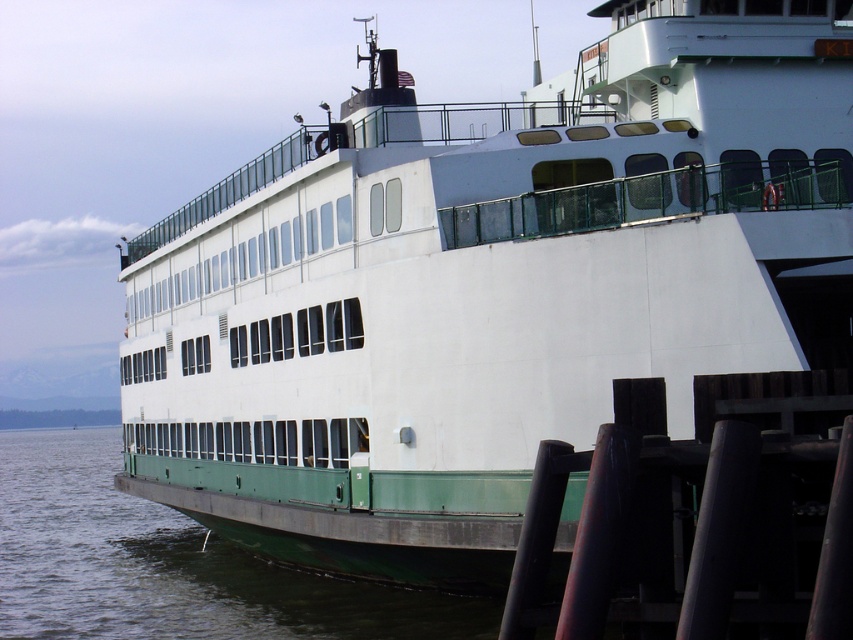
Which is more to the right, dark brown wooden posts at lower right or green matte water at lower left?

dark brown wooden posts at lower right is more to the right.

Looking at this image, measure the distance between dark brown wooden posts at lower right and camera.

dark brown wooden posts at lower right and camera are 13.63 meters apart.

Locate an element on the screen. The image size is (853, 640). dark brown wooden posts at lower right is located at coordinates (699, 516).